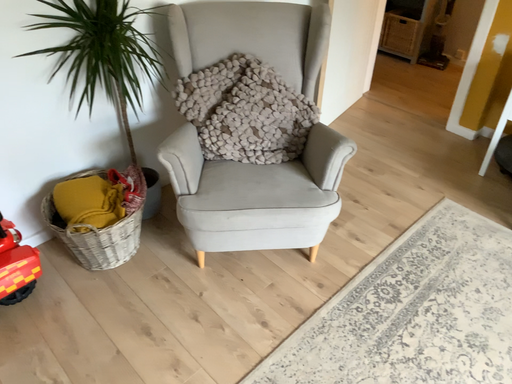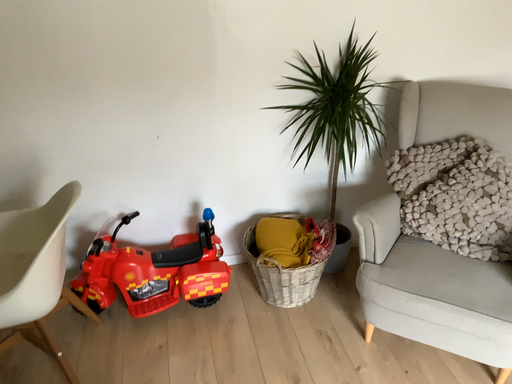
Question: Which way did the camera rotate in the video?

Choices:
 (A) rotated upward
 (B) rotated downward

Answer: (A)